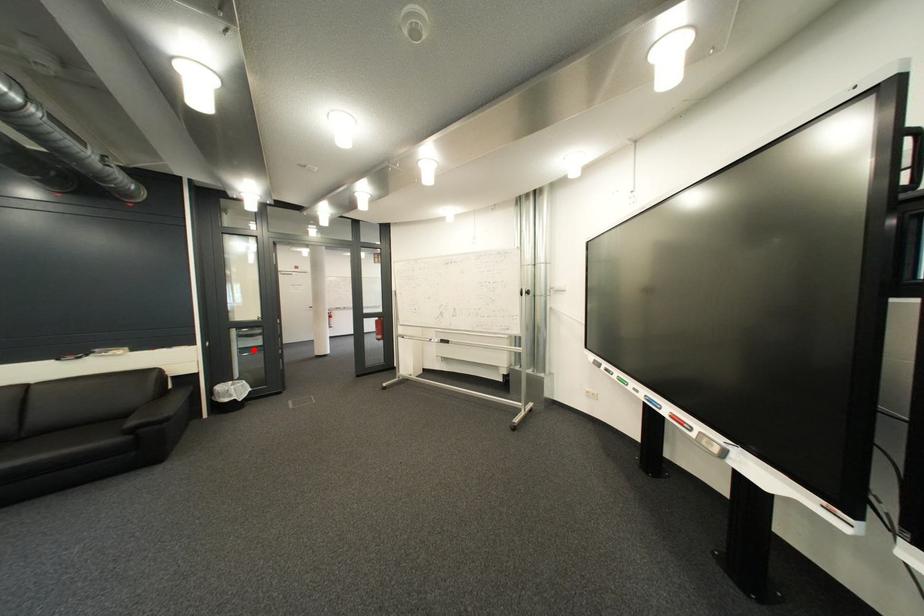
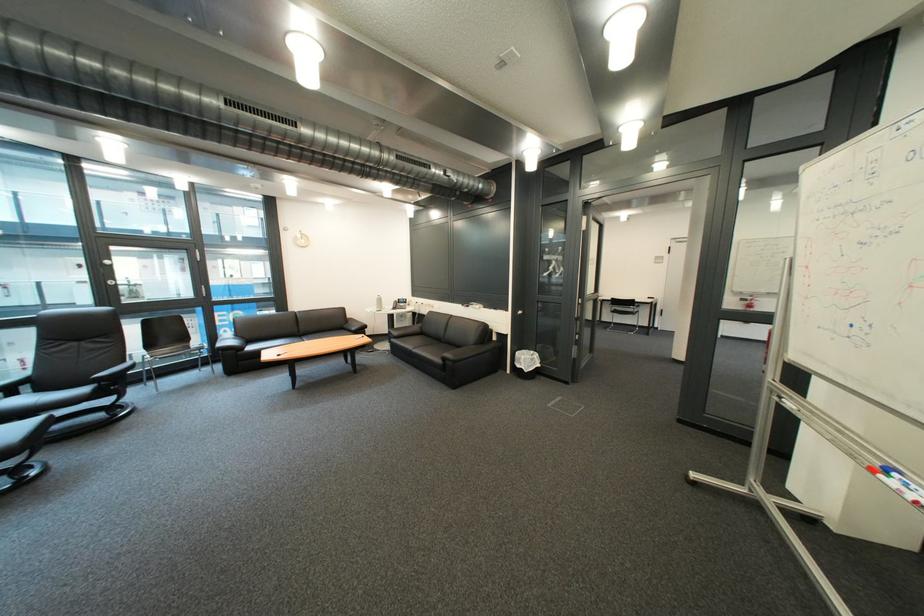
Question: A red point is marked in image1. In image2, is the corresponding 3D point closer to the camera or farther? Reply with the corresponding letter.

Choices:
 (A) The corresponding 3D point is closer.
 (B) The corresponding 3D point is farther.

Answer: (B)